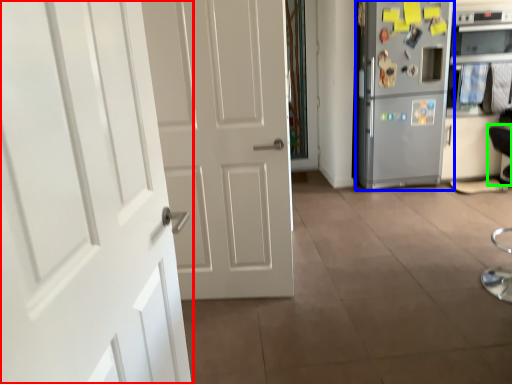
Question: Based on their relative distances, which object is farther from door (highlighted by a red box)? Choose from refrigerator (highlighted by a blue box) and armchair (highlighted by a green box).

Choices:
 (A) refrigerator
 (B) armchair

Answer: (B)